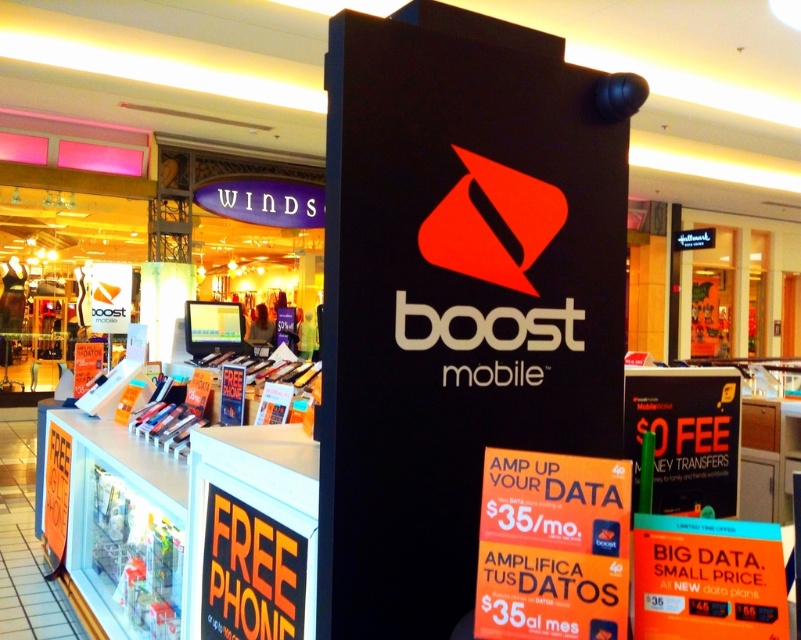
What do you see at coordinates (457, 294) in the screenshot? The height and width of the screenshot is (640, 801). I see `black matte sign at center` at bounding box center [457, 294].

Is black matte sign at center bigger than matte black sign at center?

Indeed, black matte sign at center has a larger size compared to matte black sign at center.

Locate an element on the screen. This screenshot has height=640, width=801. black matte sign at center is located at coordinates (457, 294).

This screenshot has height=640, width=801. I want to click on black matte sign at center, so click(x=457, y=294).

Does orange paper sign at center have a greater height compared to matte black sign at center?

In fact, orange paper sign at center may be shorter than matte black sign at center.

Who is positioned more to the right, orange paper sign at center or matte black sign at center?

matte black sign at center

The width and height of the screenshot is (801, 640). Describe the element at coordinates (552, 547) in the screenshot. I see `orange paper sign at center` at that location.

Image resolution: width=801 pixels, height=640 pixels. In order to click on orange paper sign at center in this screenshot , I will do `click(552, 547)`.

Is orange paper sign at center wider than orange paper at center?

Yes.

Can you confirm if orange paper sign at center is bigger than orange paper at center?

Correct, orange paper sign at center is larger in size than orange paper at center.

Does point (568, 500) lie behind point (767, 628)?

That is True.

Where is `orange paper sign at center`? This screenshot has width=801, height=640. orange paper sign at center is located at coordinates (552, 547).